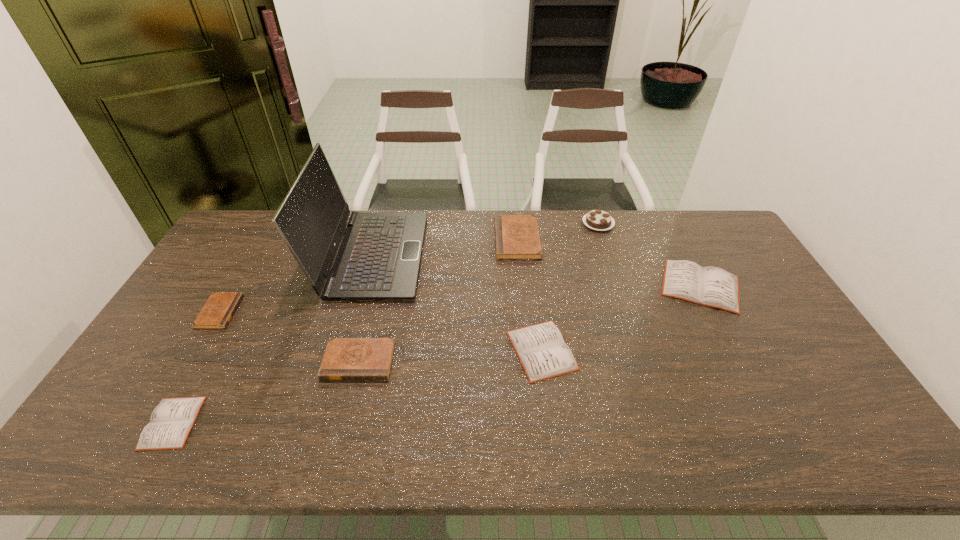
Locate an element on the screen. free space that satisfies the following two spatial constraints: 1. on the spine side of the farthest white diary; 2. on the left side of the farthest diary is located at coordinates (521, 286).

Locate an element on the screen. blank area in the image that satisfies the following two spatial constraints: 1. on the back side of the rightmost object; 2. on the left side of the second white diary from right to left is located at coordinates (x=534, y=286).